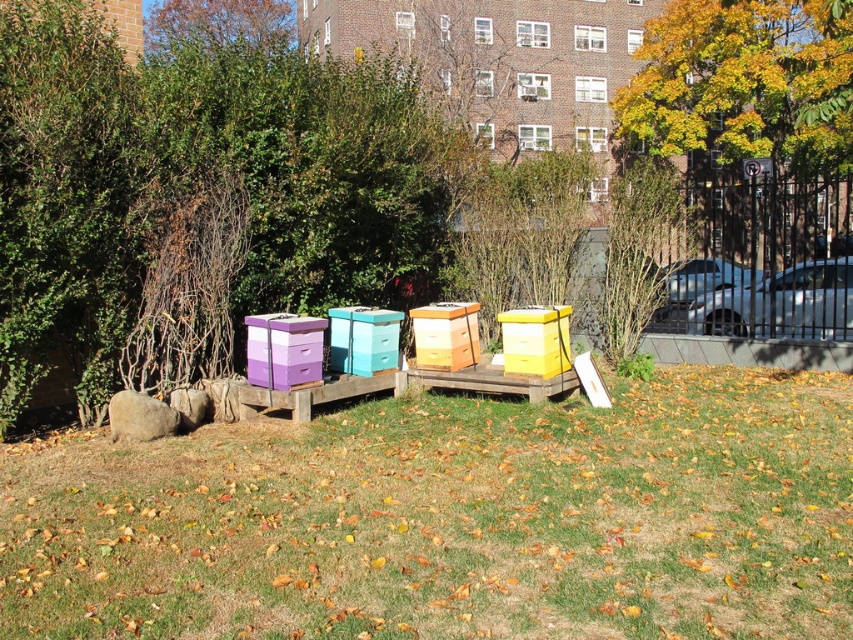
You are a beekeeper standing between the purple matte beehive at center and the yellow matte beehive at center. You need to place a 6.5 feet long ladder between them. Will the ladder fit between the two beehives?

The purple matte beehive at center is 6.90 feet from the yellow matte beehive at center. Since the ladder is 6.5 feet long, it will fit between them as the distance between the hives is greater than the ladder length.

You are standing in the backyard and want to place a small garden ornament between the green grass at center and the wooden beehive at center. Based on their positions, which object should the ornament be closer to?

The green grass at center is positioned on the left side of the wooden beehive at center, so the ornament should be placed closer to the green grass at center to be between them.